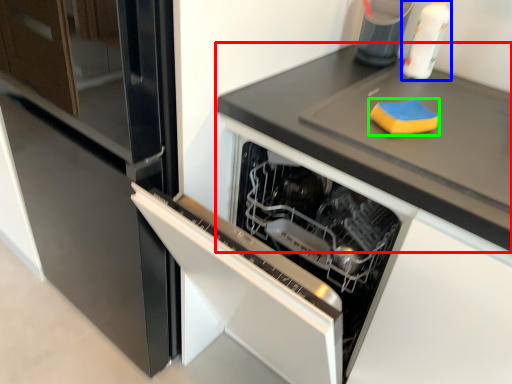
Question: Considering the real-world distances, which object is closest to countertop (highlighted by a red box)? bottle (highlighted by a blue box) or food (highlighted by a green box).

Choices:
 (A) bottle
 (B) food

Answer: (B)